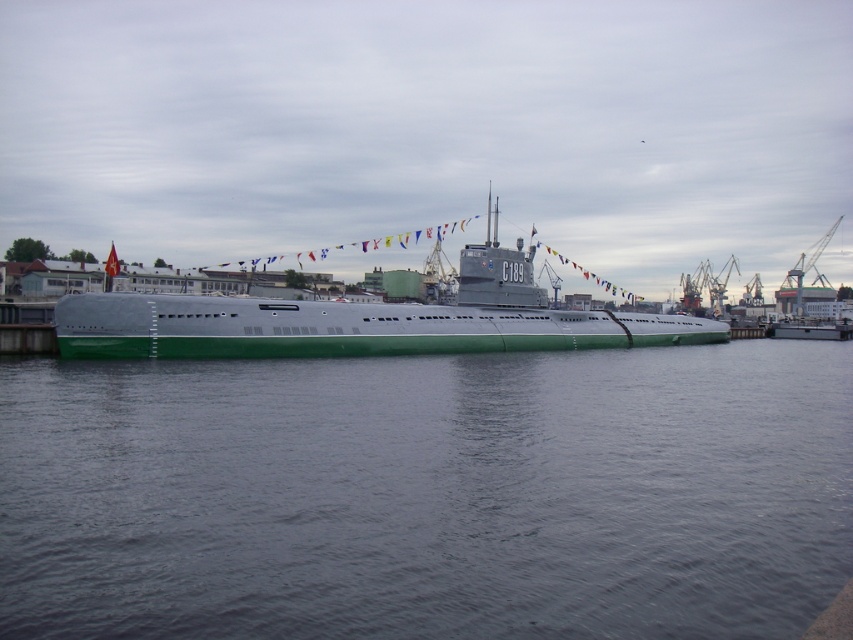
Question: Which object is closer to the camera taking this photo?

Choices:
 (A) green matte submarine at center
 (B) green matte water at center

Answer: (B)

Question: Can you confirm if green matte water at center is thinner than green matte submarine at center?

Choices:
 (A) yes
 (B) no

Answer: (A)

Question: Can you confirm if green matte water at center is thinner than green matte submarine at center?

Choices:
 (A) no
 (B) yes

Answer: (B)

Question: Is green matte water at center to the left of green matte submarine at center from the viewer's perspective?

Choices:
 (A) no
 (B) yes

Answer: (B)

Question: Which object appears farthest from the camera in this image?

Choices:
 (A) green matte water at center
 (B) green matte submarine at center

Answer: (B)

Question: Which of the following is the farthest from the observer?

Choices:
 (A) green matte submarine at center
 (B) green matte water at center

Answer: (A)